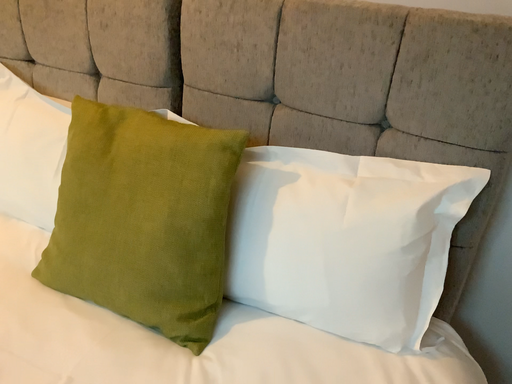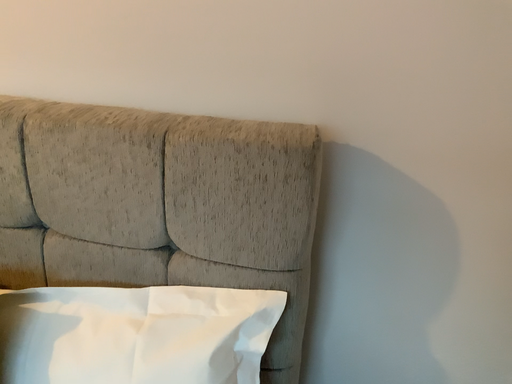
Question: How did the camera likely rotate when shooting the video?

Choices:
 (A) rotated left
 (B) rotated right

Answer: (B)